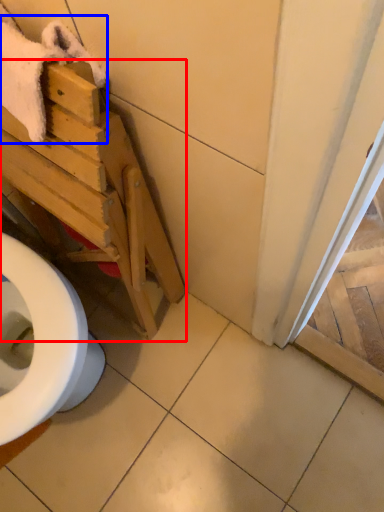
Question: Which of the following is the closest to the observer, furniture (highlighted by a red box) or bath towel (highlighted by a blue box)?

Choices:
 (A) furniture
 (B) bath towel

Answer: (A)